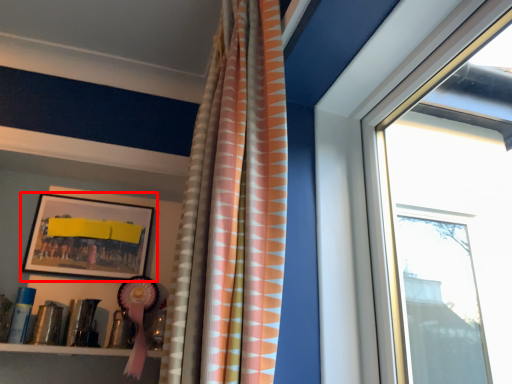
Question: Where is picture frame (annotated by the red box) located in relation to curtain in the image?

Choices:
 (A) right
 (B) left

Answer: (B)